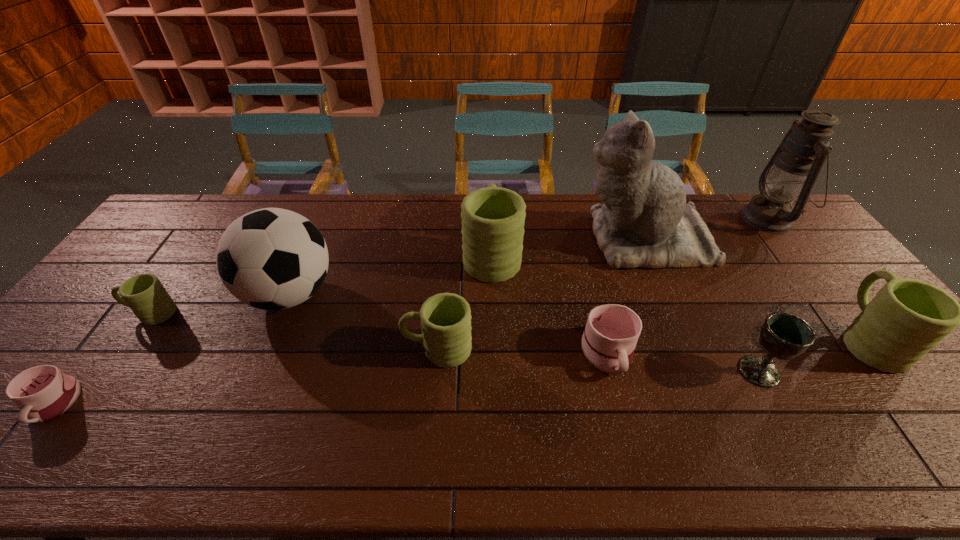
Identify the location of vacant space located on the side of the biggest green mug with the handle. (491, 196).

The height and width of the screenshot is (540, 960). In order to click on vacant position located on the side of the biggest green mug with the handle in this screenshot , I will do `click(491, 210)`.

At what (x,y) coordinates should I click in order to perform the action: click on free space located on the side of the rightmost green mug with the handle. Please return your answer as a coordinate pair (x, y). The image size is (960, 540). Looking at the image, I should click on (781, 231).

Where is `free space located on the side of the rightmost green mug with the handle`? This screenshot has height=540, width=960. free space located on the side of the rightmost green mug with the handle is located at coordinates (808, 265).

You are a GUI agent. You are given a task and a screenshot of the screen. Output one action in this format:
    pyautogui.click(x=<x>, y=<y>)
    Task: Click on the vacant area situated on the side of the rightmost green mug with the handle
    
    Given the screenshot: What is the action you would take?
    [x=780, y=229]

You are a GUI agent. You are given a task and a screenshot of the screen. Output one action in this format:
    pyautogui.click(x=<x>, y=<y>)
    Task: Click on the vacant space located on the right of the chalice
    
    Given the screenshot: What is the action you would take?
    pyautogui.click(x=884, y=372)

Image resolution: width=960 pixels, height=540 pixels. Identify the location of vacant space located on the side of the fourth shortest mug with the handle. (349, 349).

At what (x,y) coordinates should I click in order to perform the action: click on vacant space located on the side of the fourth shortest mug with the handle. Please return your answer as a coordinate pair (x, y). Looking at the image, I should click on (307, 349).

Identify the location of vacant space situated on the side of the fourth shortest mug with the handle. The image size is (960, 540). (365, 349).

Locate an element on the screen. The width and height of the screenshot is (960, 540). free space located on the side of the smallest green mug with the handle is located at coordinates (84, 313).